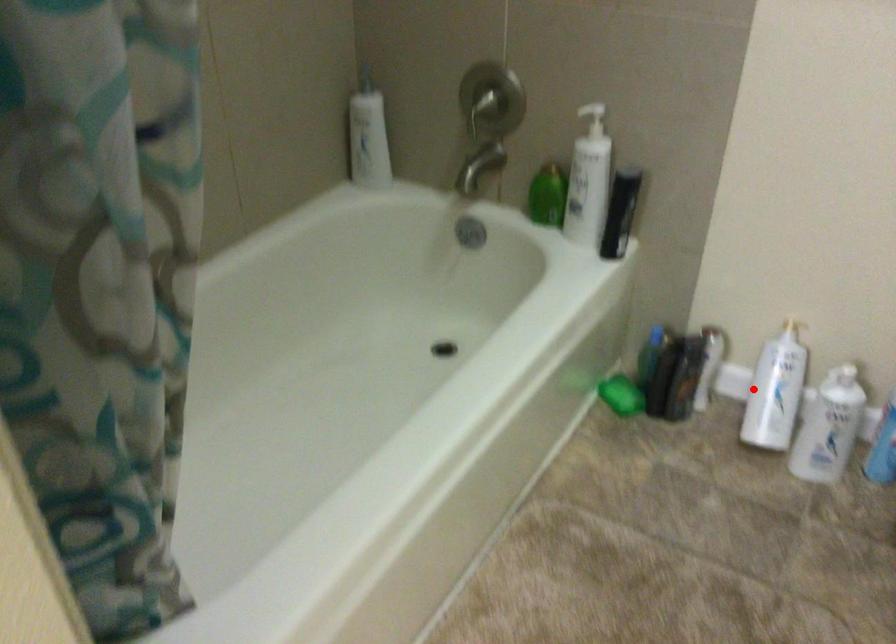
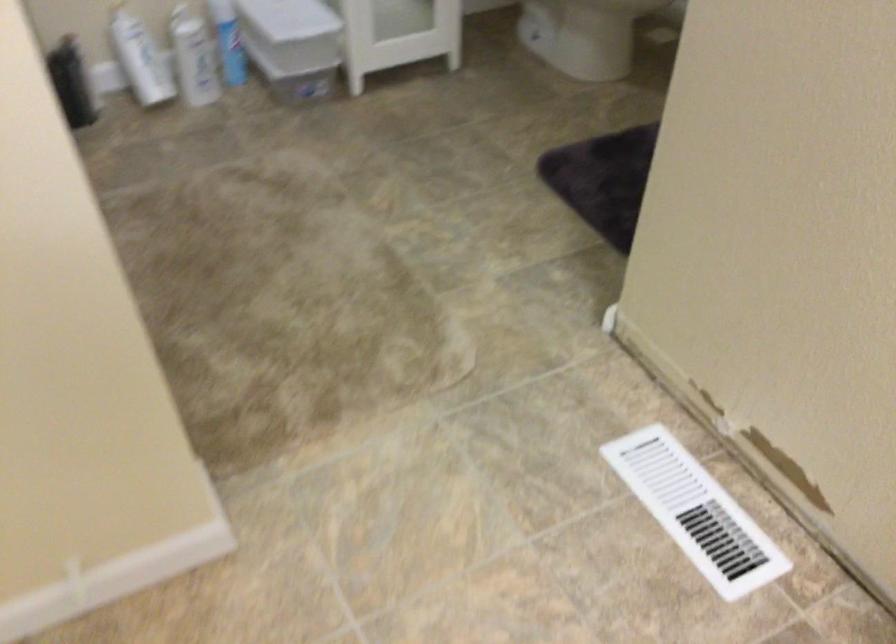
Question: I am providing you with two images of the same scene from different viewpoints. Image1 has a red point marked. In image2, the corresponding 3D location appears at what relative position? Reply with the corresponding letter.

Choices:
 (A) Closer
 (B) Farther

Answer: (B)